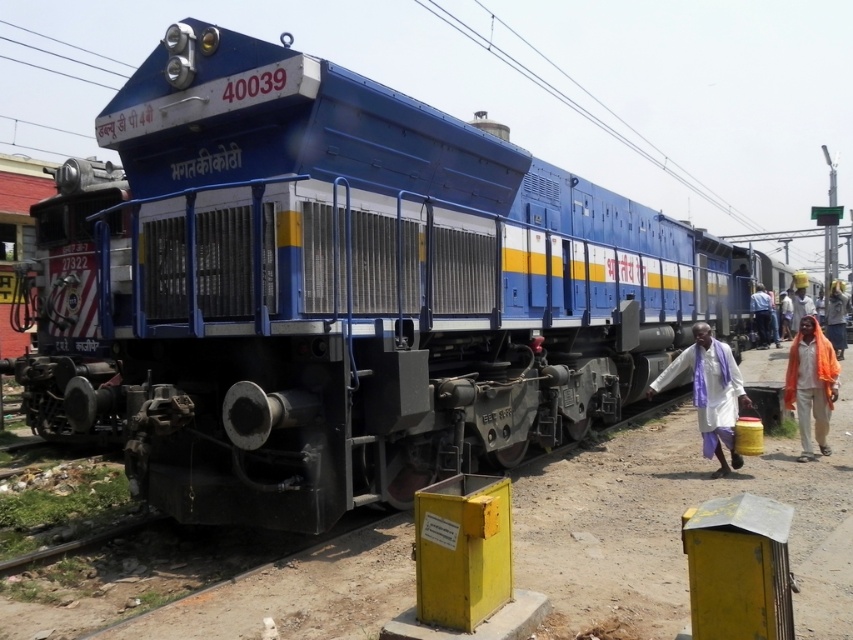
Consider the image. Who is lower down, white cotton cloth at lower right or white cloth at right?

white cotton cloth at lower right is below.

Does white cotton cloth at lower right have a larger size compared to white cloth at right?

Actually, white cotton cloth at lower right might be smaller than white cloth at right.

Between point (715, 369) and point (804, 285), which one is positioned in front?

Point (715, 369)

Where is `white cotton cloth at lower right`? Image resolution: width=853 pixels, height=640 pixels. white cotton cloth at lower right is located at coordinates (711, 392).

Between point (718, 445) and point (766, 308), which one is positioned in front?

Point (718, 445) is more forward.

Who is shorter, white cotton cloth at lower right or white cloth at center?

white cotton cloth at lower right is shorter.

Is point (724, 394) positioned after point (767, 330)?

That is False.

Locate an element on the screen. The image size is (853, 640). white cotton cloth at lower right is located at coordinates (711, 392).

Who is lower down, white cloth at center or white cloth at right?

white cloth at center is lower down.

Is white cloth at center taller than white cloth at right?

Incorrect, white cloth at center's height is not larger of white cloth at right's.

Based on the photo, who is more forward, (x=769, y=300) or (x=791, y=314)?

Point (x=769, y=300)

In order to click on white cloth at center in this screenshot , I will do `click(761, 314)`.